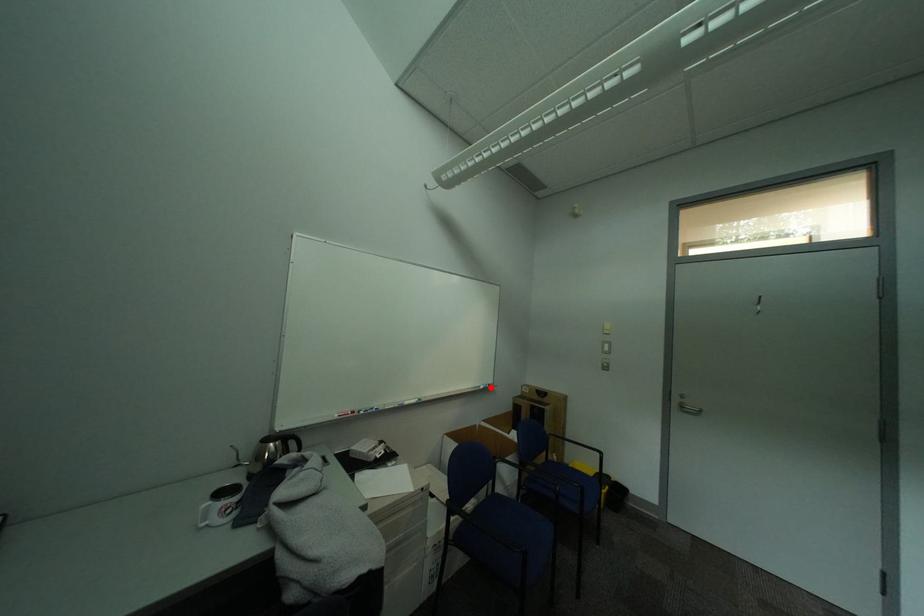
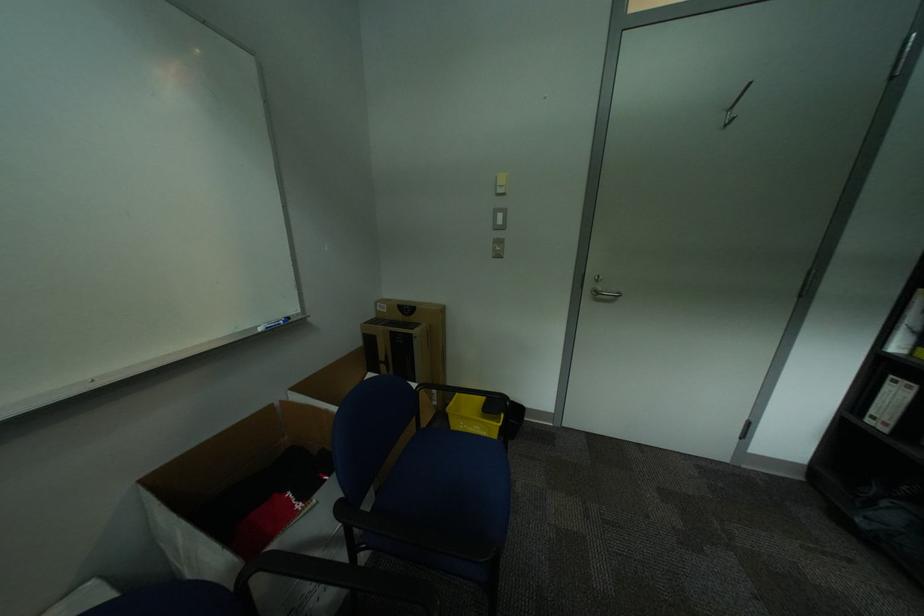
Question: I am providing you with two images of the same scene from different viewpoints. A red point is marked on the first image. At the location where the point appears in image 1, is it still visible in image 2?

Choices:
 (A) Yes
 (B) No

Answer: (A)